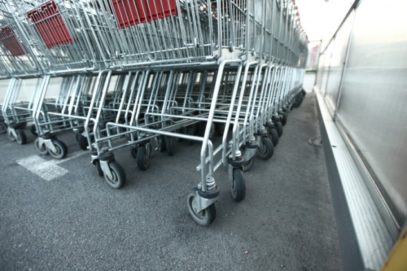
This screenshot has width=407, height=271. In order to click on 2nd red seating area for child in this screenshot , I will do (54, 45).